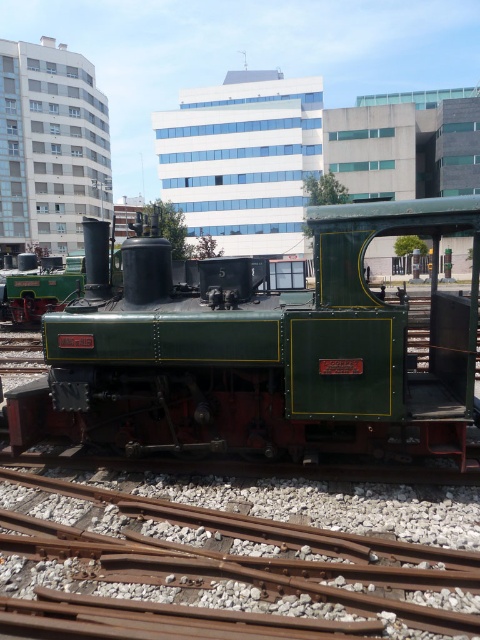
Question: Which point is closer to the camera?

Choices:
 (A) (393, 624)
 (B) (178, 426)

Answer: (A)

Question: Does green matte train at center appear under rusty metal train track at lower center?

Choices:
 (A) yes
 (B) no

Answer: (B)

Question: Considering the relative positions of green matte train at center and rusty metal train track at lower center in the image provided, where is green matte train at center located with respect to rusty metal train track at lower center?

Choices:
 (A) right
 (B) left

Answer: (A)

Question: Is green matte train at center to the left of rusty metal train track at lower center from the viewer's perspective?

Choices:
 (A) yes
 (B) no

Answer: (B)